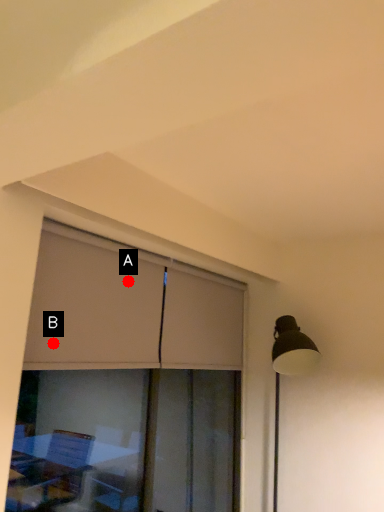
Question: Two points are circled on the image, labeled by A and B beside each circle. Which of the following is the closest to the observer?

Choices:
 (A) A is closer
 (B) B is closer

Answer: (B)